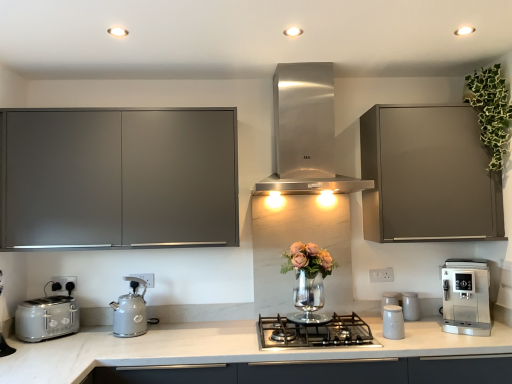
Question: Considering the positions of satin silver coffee machine at lower right, the 2th home appliance viewed from the top, and satin silver toaster at left in the image, is satin silver coffee machine at lower right, the 2th home appliance viewed from the top, bigger or smaller than satin silver toaster at left?

Choices:
 (A) small
 (B) big

Answer: (B)

Question: Considering the positions of satin silver coffee machine at lower right, the 1th home appliance in the bottom-to-top sequence, and satin silver toaster at left in the image, is satin silver coffee machine at lower right, the 1th home appliance in the bottom-to-top sequence, taller or shorter than satin silver toaster at left?

Choices:
 (A) short
 (B) tall

Answer: (B)

Question: Considering the real-world distances, which object is closest to the white ceramic canisters at center-right, arranged as the 1th kitchen appliance when viewed from the back?

Choices:
 (A) white marble countertop at center
 (B) stainless steel range hood at center, acting as the 1th home appliance starting from the left
 (C) satin silver coffee machine at lower right, the first home appliance viewed from the right
 (D) matte gray cabinet at upper right, which ranks as the second cabinetry in left-to-right order
 (E) white plastic electric outlet at lower right, which is counted as the third electric outlet, starting from the back

Answer: (C)

Question: Based on their relative distances, which object is farther from the white ceramic canisters at center-right, marked as the first kitchen appliance in a right-to-left arrangement?

Choices:
 (A) matte gray cabinet at upper right, acting as the 1th cabinetry starting from the right
 (B) satin silver coffee machine at lower right, positioned as the 2th home appliance in left-to-right order
 (C) white plastic electric outlet at lower center, positioned as the third electric outlet in right-to-left order
 (D) stainless steel gas stove at center
 (E) white plastic electric outlet at center, acting as the second electric outlet starting from the left

Answer: (C)